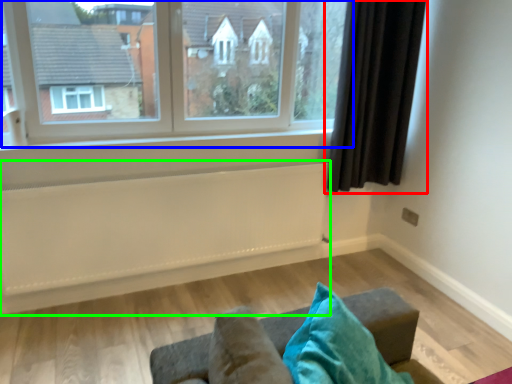
Question: Which object is the farthest from curtain (highlighted by a red box)? Choose among these: window (highlighted by a blue box) or radiator (highlighted by a green box).

Choices:
 (A) window
 (B) radiator

Answer: (B)